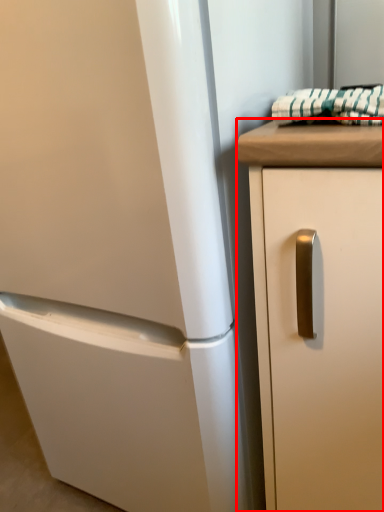
Question: From the image's perspective, what is the correct spatial relationship of cabinetry (annotated by the red box) in relation to blanket?

Choices:
 (A) above
 (B) below

Answer: (B)